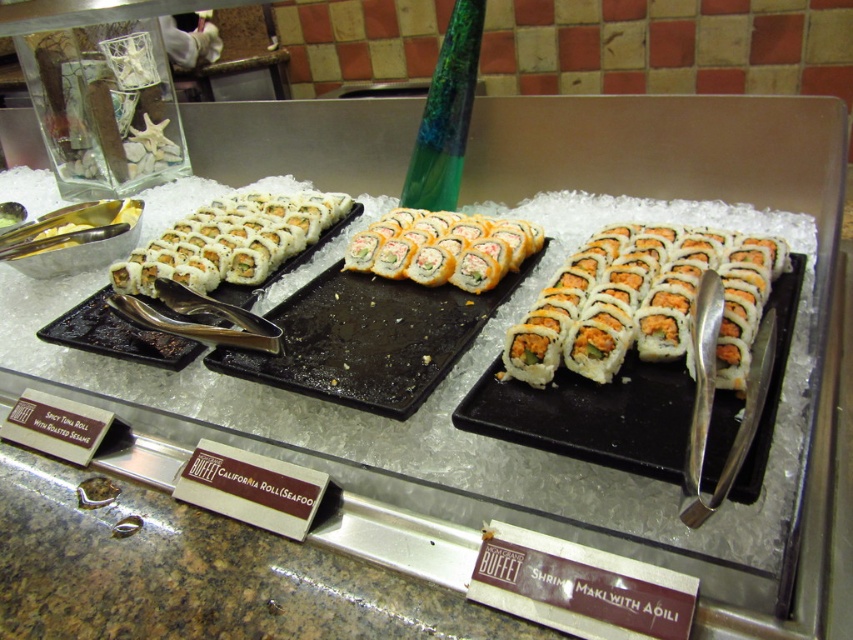
Question: Does orange cream cheese maki at center lie behind white rice paper at center?

Choices:
 (A) yes
 (B) no

Answer: (A)

Question: Can you confirm if white rice roll at left is thinner than white rice paper at center?

Choices:
 (A) no
 (B) yes

Answer: (B)

Question: Which object is positioned farthest from the white rice paper at center?

Choices:
 (A) white rice roll at left
 (B) black matte california roll at center
 (C) orange cream cheese maki at center
 (D) white matte sushi roll at center

Answer: (D)

Question: Is white rice wrapped sushi at center in front of white rice paper at center?

Choices:
 (A) yes
 (B) no

Answer: (A)

Question: Which object appears closest to the camera in this image?

Choices:
 (A) orange cream cheese maki at center
 (B) white rice roll at left
 (C) white matte sushi roll at center
 (D) white rice wrapped sushi at center

Answer: (C)

Question: Which point is farther from the camera taking this photo?

Choices:
 (A) (300, 208)
 (B) (192, 340)
 (C) (418, 406)

Answer: (A)